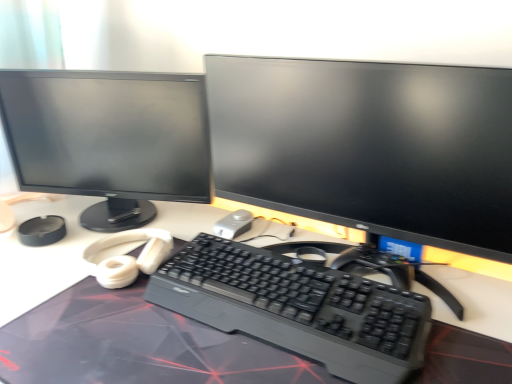
Find the location of a particular element. This screenshot has height=384, width=512. free location to the right of satin silver mouse at center is located at coordinates (290, 226).